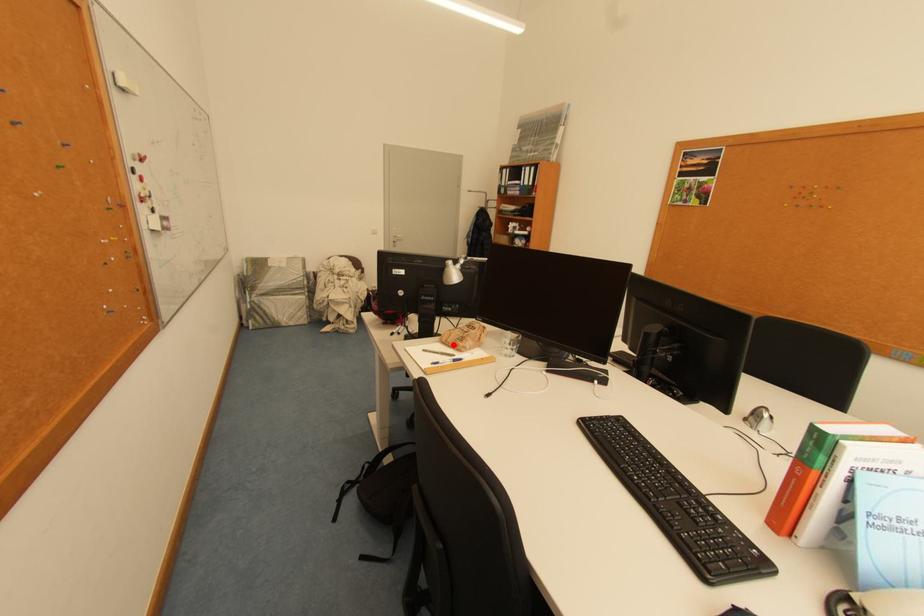
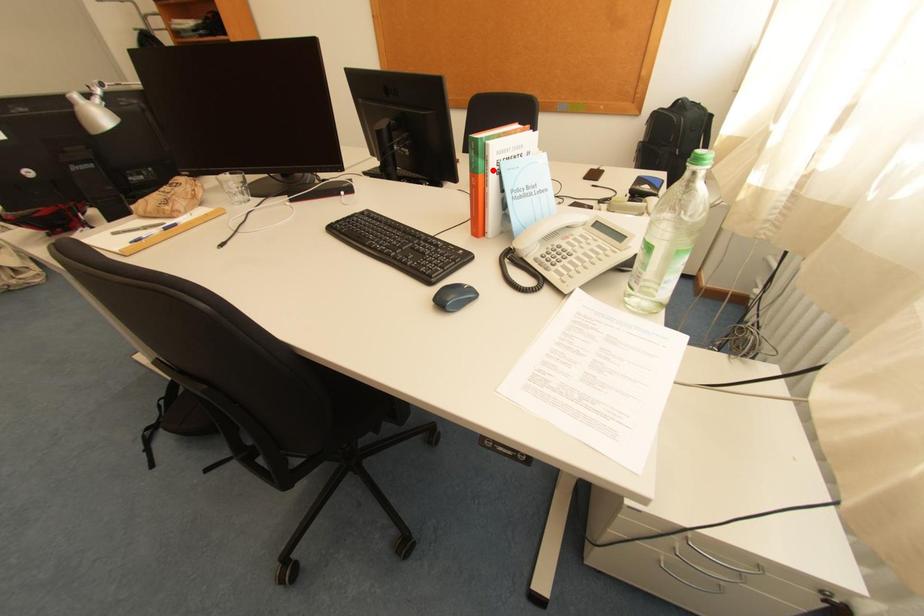
I am providing you with two images of the same scene from different viewpoints. A red point is marked on the first image and another point is marked on the second image. Do the highlighted points in image1 and image2 indicate the same real-world spot?

No